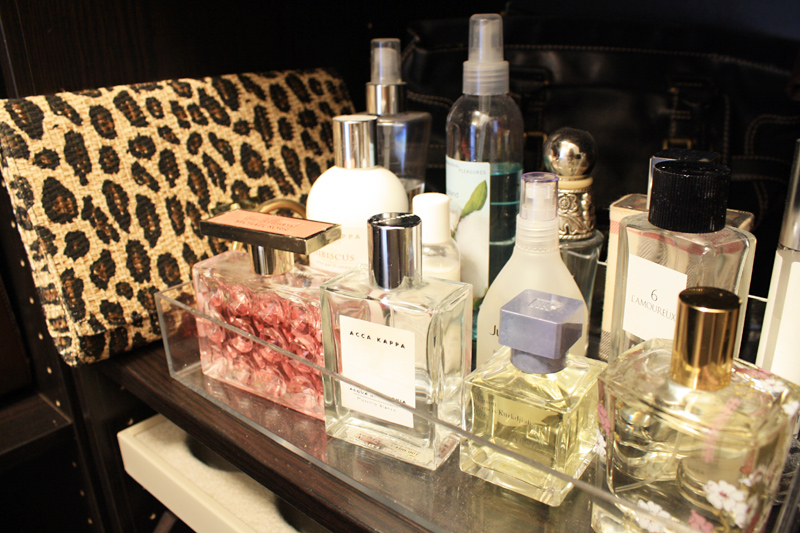
Locate an element on the screen. This screenshot has height=533, width=800. wooden shelf is located at coordinates (301, 475).